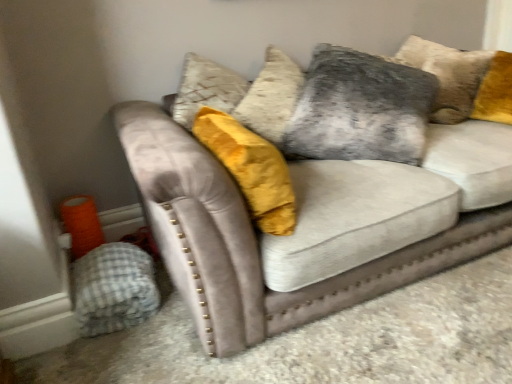
Question: Is point (365, 145) closer or farther from the camera than point (112, 286)?

Choices:
 (A) farther
 (B) closer

Answer: (A)

Question: Based on their sizes in the image, would you say velvet gray pillow at upper center is bigger or smaller than gray checkered blanket at lower left?

Choices:
 (A) small
 (B) big

Answer: (B)

Question: Based on their relative distances, which object is nearer to the velvet gray pillow at upper center?

Choices:
 (A) gray checkered blanket at lower left
 (B) velvet gray couch at center

Answer: (B)

Question: Based on their relative distances, which object is nearer to the velvet gray pillow at upper center?

Choices:
 (A) velvet gray couch at center
 (B) gray checkered blanket at lower left

Answer: (A)